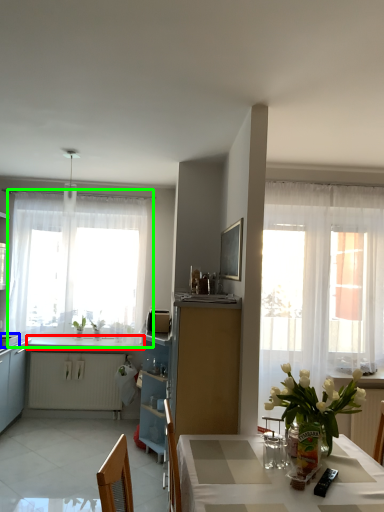
Question: Considering the real-world distances, which object is closest to counter top (highlighted by a red box)? appliance (highlighted by a blue box) or window (highlighted by a green box).

Choices:
 (A) appliance
 (B) window

Answer: (A)